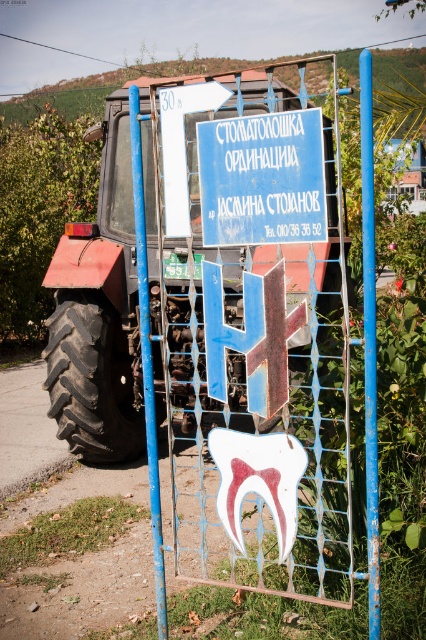
You are a farmer standing next to your rustic metal tractor at left and looking at the blue painted metal sign at center. Which object is taller?

The rustic metal tractor at left is taller than the blue painted metal sign at center.

Based on the photo, you are driving a car and see the rustic metal tractor at left and the blue painted metal sign at center. Which object would block your view more if you were driving past them?

The rustic metal tractor at left would block your view more because it is bigger than the blue painted metal sign at center.